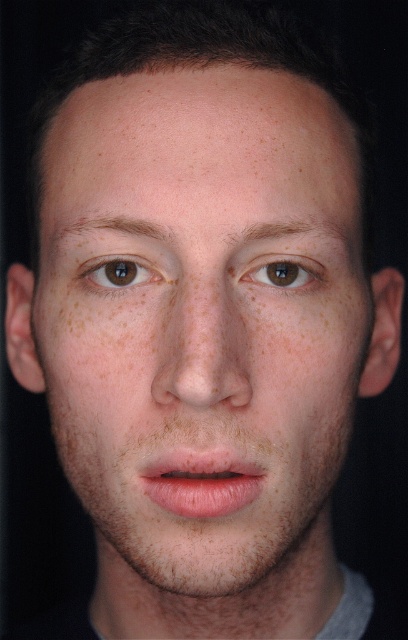
Is natural skin tone freckled face at center positioned before brown matte eye at center?

Yes, natural skin tone freckled face at center is in front of brown matte eye at center.

Who is positioned more to the right, natural skin tone freckled face at center or brown matte eye at center?

Positioned to the right is brown matte eye at center.

Does point (208, 483) lie behind point (299, 284)?

That is False.

Find the location of a particular element. natural skin tone freckled face at center is located at coordinates (203, 321).

Can you confirm if natural skin tone freckled face at center is smaller than brown matte eye at upper left?

No, natural skin tone freckled face at center is not smaller than brown matte eye at upper left.

Who is lower down, natural skin tone freckled face at center or brown matte eye at upper left?

natural skin tone freckled face at center

Who is more forward, (79, 113) or (130, 273)?

Point (130, 273) is more forward.

In order to click on natural skin tone freckled face at center in this screenshot , I will do `click(203, 321)`.

Is point (130, 272) positioned behind point (281, 278)?

Yes, it is.

Can you confirm if brown matte eye at upper left is positioned below brown matte eye at center?

Incorrect, brown matte eye at upper left is not positioned below brown matte eye at center.

From the picture: Who is more forward, [104,284] or [303,282]?

Point [104,284]

Find the location of a particular element. This screenshot has width=408, height=640. brown matte eye at upper left is located at coordinates (119, 273).